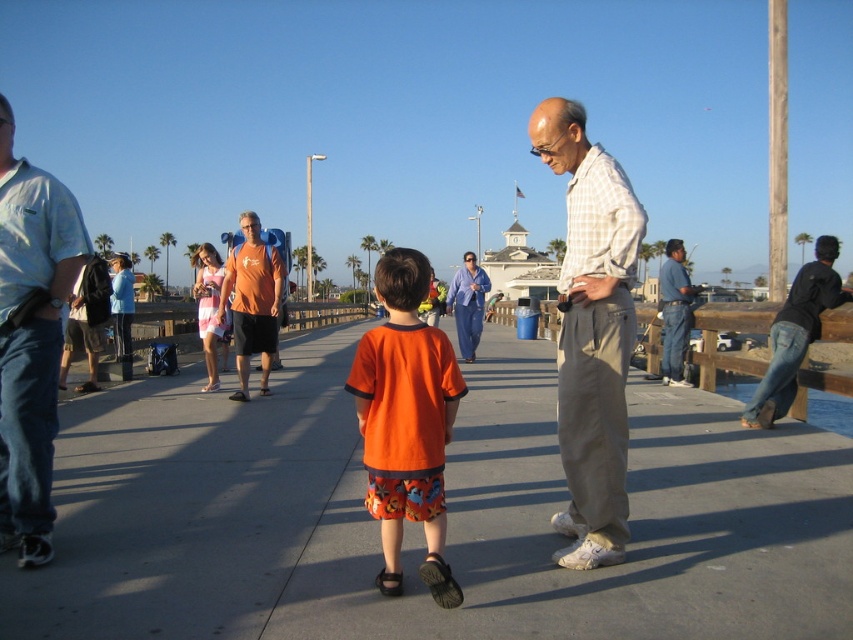
You are a delivery person carrying a package wrapped in the black leather jacket at right. You need to place it on the smooth concrete pavement at center. Is the jacket currently on top of the pavement?

The smooth concrete pavement at center is positioned under the black leather jacket at right, meaning the jacket is currently on top of the pavement.

Consider the image. You are standing at the point marked as point (49, 342) on the boardwalk. You want to throw a frisbee to your friend who is standing 4 meters away from you. Is your friend within reach?

The distance between point (49, 342) and the viewer is 3.96 meters, so yes, your friend is within reach since the distance is just under 4 meters.

You are standing on the boardwalk and want to place a small potted plant exactly where the smooth concrete pavement at center is located. According to the coordinates provided, where should you place the potted plant?

You should place the potted plant at point (418,525) on the smooth concrete pavement at center as specified in the coordinates.